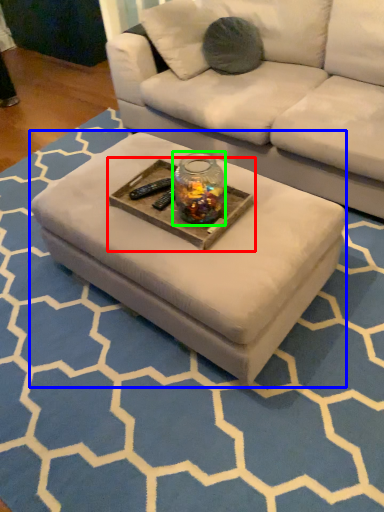
Question: Considering the real-world distances, which object is closest to round table (highlighted by a red box)? coffee table (highlighted by a blue box) or glass jar (highlighted by a green box).

Choices:
 (A) coffee table
 (B) glass jar

Answer: (B)